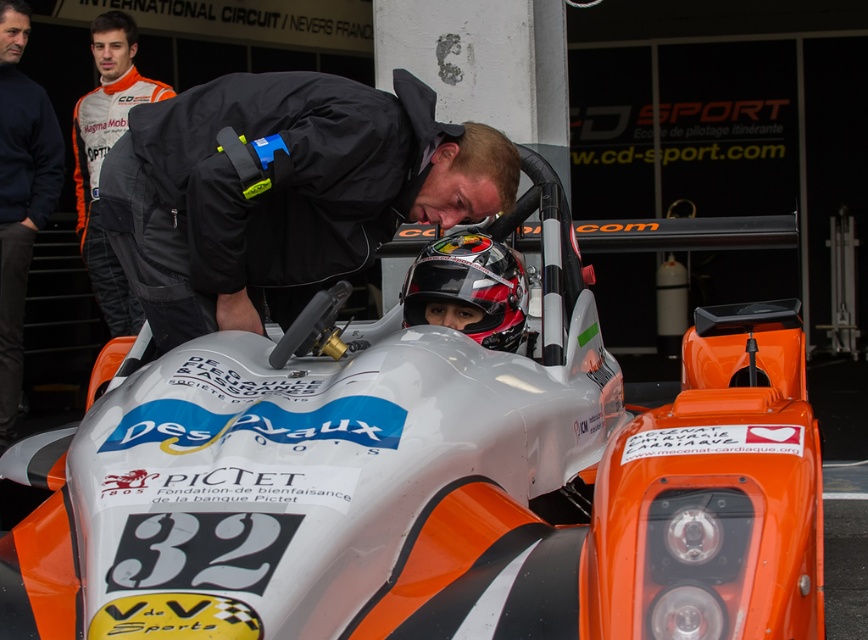
You are a photographer at the motorsport event. You want to take a photo of the orange matte race car at center and the black matte jacket at center. From your current position, can you see both objects in the same frame without moving your camera? Explain why or why not.

The orange matte race car at center is in front of the black matte jacket at center, so the race car would block the view of the jacket. Therefore, you cannot see both objects in the same frame without moving the camera.

You are a photographer at the motorsport event. You need to take a photo of the two clothing items, the black matte jacket at center and the navy blue sweatshirt at left. Based on their sizes, which clothing item will occupy more space in the photo?

The black matte jacket at center has a larger size compared to the navy blue sweatshirt at left, so it will occupy more space in the photo.

You are a photographer at the motorsport event. You want to take a photo of the orange matte race car at center and the black matte jacket at center. If you need to ensure both are fully visible in the frame, which object should you focus on first to avoid cropping?

The orange matte race car at center is bigger than the black matte jacket at center, so you should focus on the orange matte race car at center first to ensure it fits in the frame before adjusting for the smaller jacket.